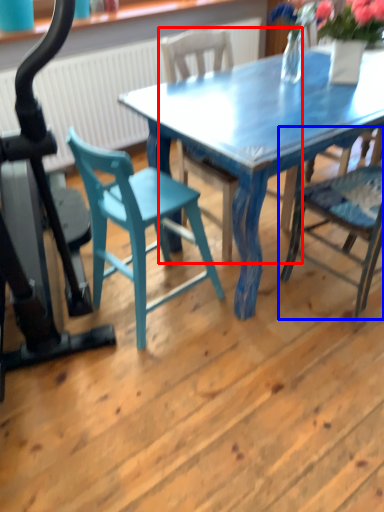
Question: Which object is further to the camera taking this photo, chair (highlighted by a red box) or chair (highlighted by a blue box)?

Choices:
 (A) chair
 (B) chair

Answer: (A)